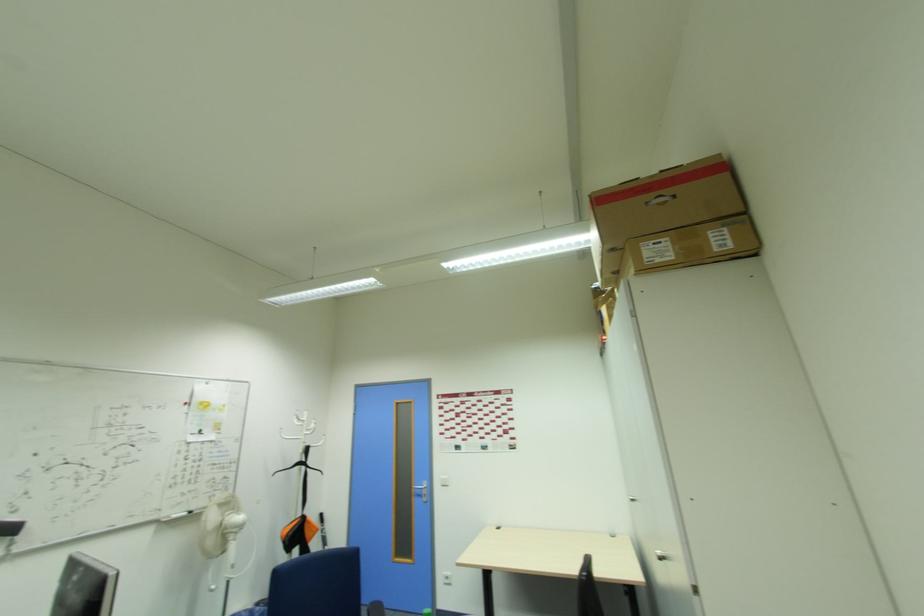
The image size is (924, 616). What do you see at coordinates (420, 485) in the screenshot?
I see `a silver door handle` at bounding box center [420, 485].